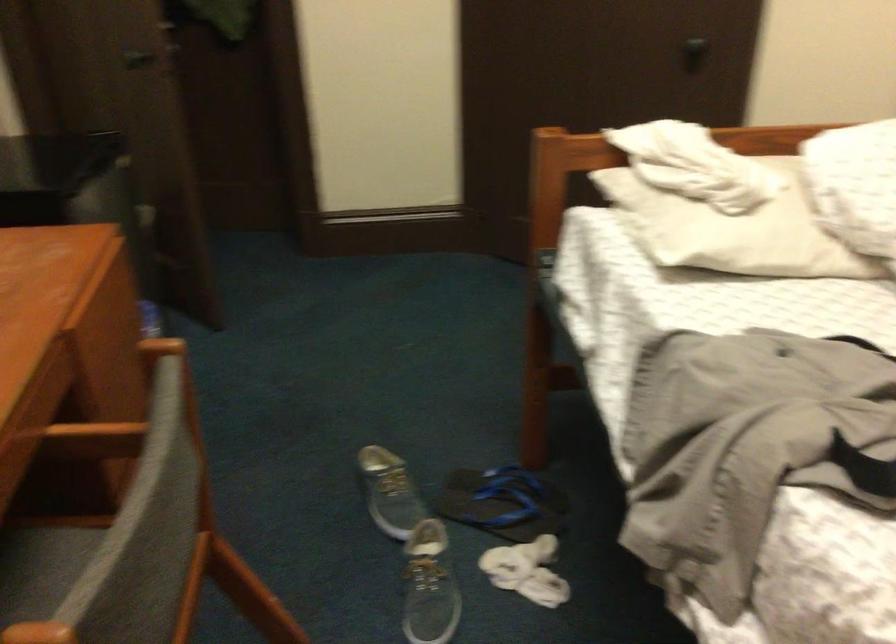
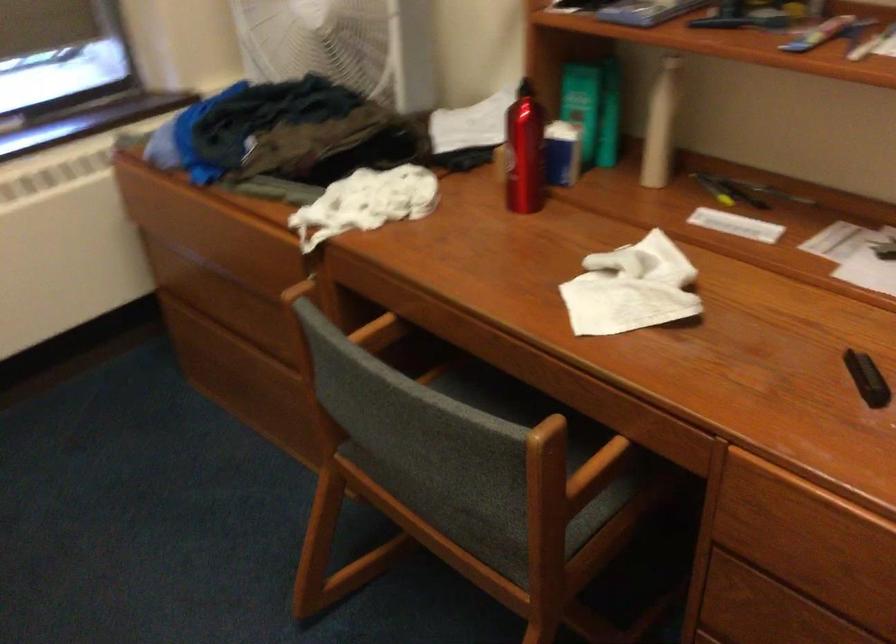
Find the pixel in the second image that matches point (191, 475) in the first image.

(488, 509)